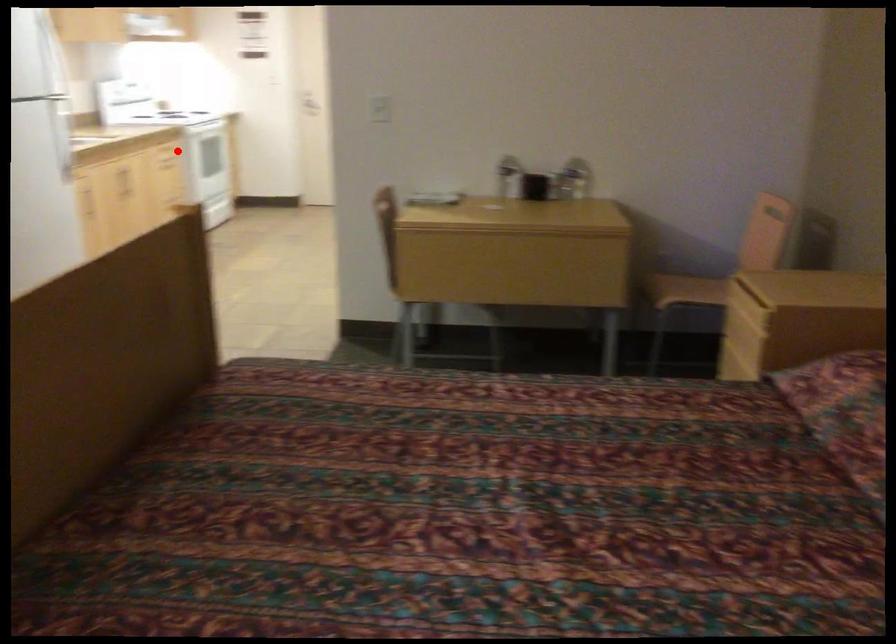
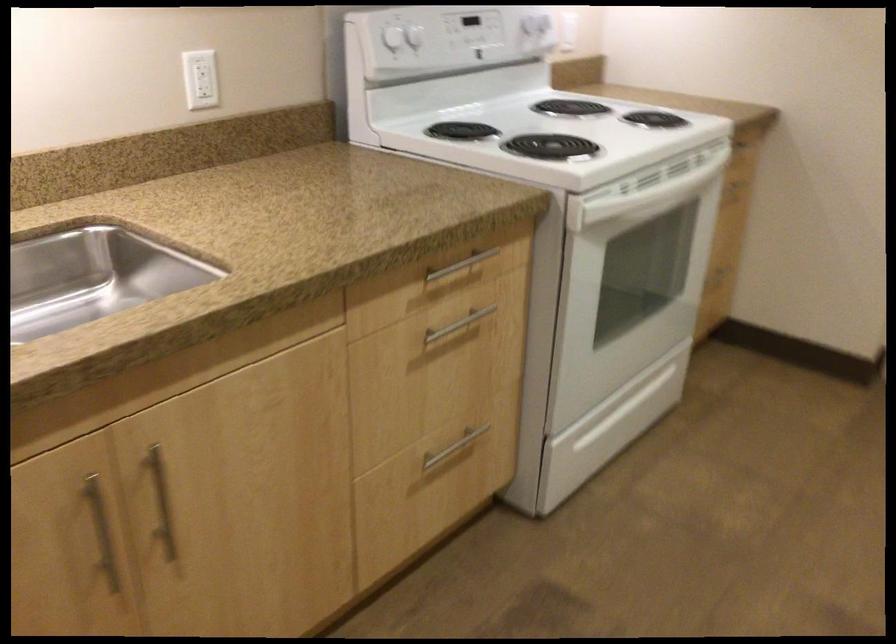
Question: I am providing you with two images of the same scene from different viewpoints. A red point is shown in image1. For the corresponding object point in image2, is it positioned nearer or farther from the camera?

Choices:
 (A) Nearer
 (B) Farther

Answer: (A)